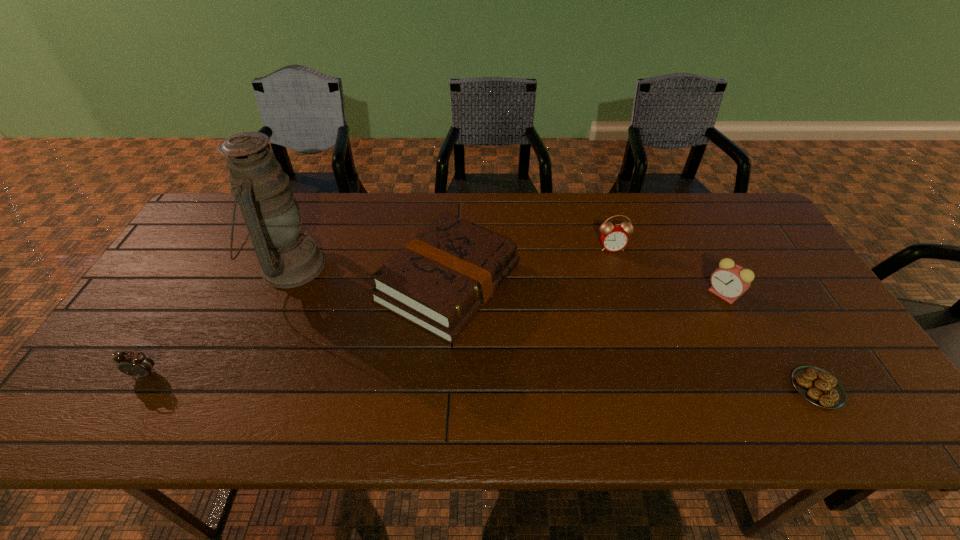
This screenshot has height=540, width=960. I want to click on hardback book located at the far edge, so pos(439,281).

Locate an element on the screen. This screenshot has height=540, width=960. object located at the near edge is located at coordinates (816, 385).

Identify the location of object at the left edge. (136, 364).

This screenshot has height=540, width=960. What are the coordinates of `object located in the right edge section of the desktop` in the screenshot? It's located at (816, 385).

This screenshot has height=540, width=960. Find the location of `object at the near right corner`. object at the near right corner is located at coordinates (816, 385).

In the image, there is a desktop. Where is `vacant space at the far edge`? The height and width of the screenshot is (540, 960). vacant space at the far edge is located at coordinates (372, 223).

Identify the location of free space at the near edge. Image resolution: width=960 pixels, height=540 pixels. (316, 416).

Locate an element on the screen. The image size is (960, 540). free point at the left edge is located at coordinates (146, 303).

Locate an element on the screen. This screenshot has width=960, height=540. vacant space at the right edge of the desktop is located at coordinates 784,291.

In the image, there is a desktop. Identify the location of free space at the far left corner. The height and width of the screenshot is (540, 960). (216, 225).